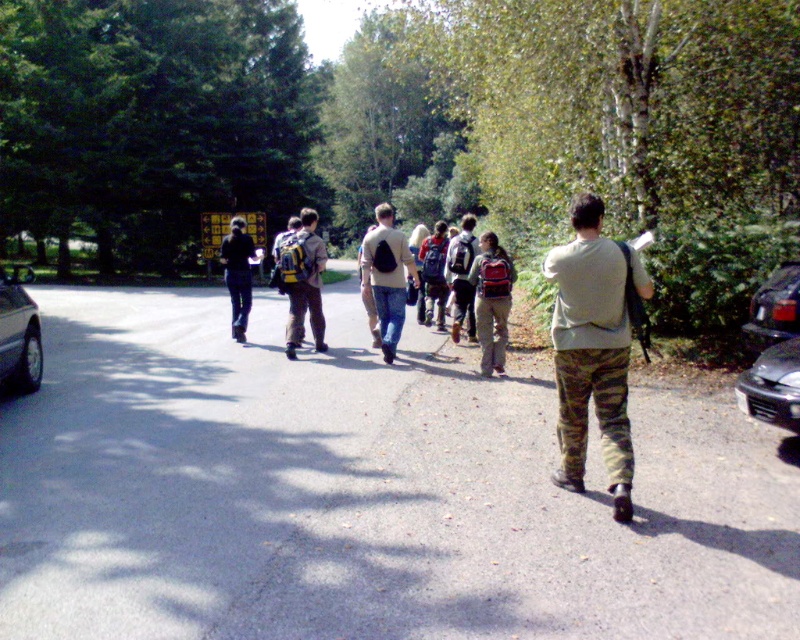
You are a photographer trying to capture a clear shot of the matte beige sweater at center and the matte gray backpack at center. Since the camera lens can only focus on one object at a time, which object should you focus on first to ensure it appears larger in the photo?

The matte beige sweater at center is bigger than the matte gray backpack at center, so you should focus on the matte beige sweater at center first to ensure it appears larger in the photo.

You are a photographer standing on the road and want to take a photo of the matte beige sweater at center and the matte gray backpack at center. Which object should you focus on first to ensure both are in clear view?

You should focus on the matte beige sweater at center first since it is closer to the viewer than the matte gray backpack at center. By focusing on the closer object, the depth of field may naturally include the backpack in the background, ensuring both are in clear view.